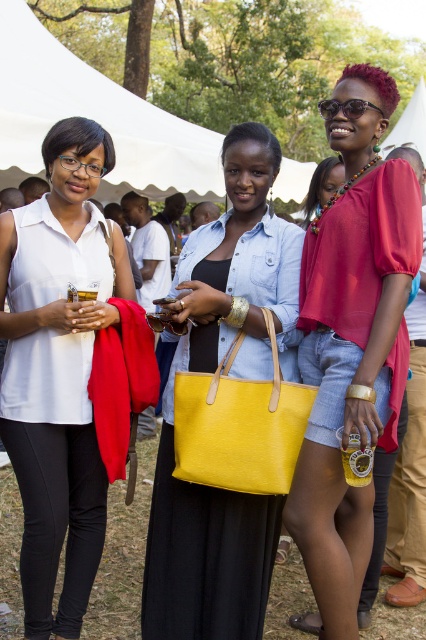
You are at the outdoor gathering and want to grab your matte yellow tote bag at center. Which object, the white fabric canopy at upper center or another object, is positioned to the left of your bag?

The white fabric canopy at upper center is positioned to the left of the matte yellow tote bag at center.

In the photo of the three women under the white canopy tent, there is a matte yellow tote bag at center and a yellow leather tote at center. Which one is closer to the camera?

The matte yellow tote bag at center is closer to the camera because the yellow leather tote at center is behind it.